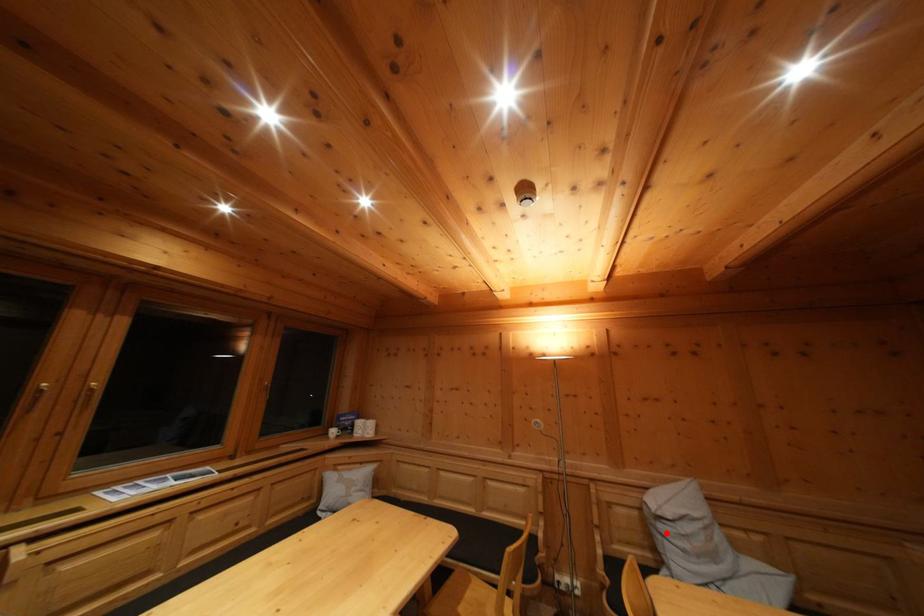
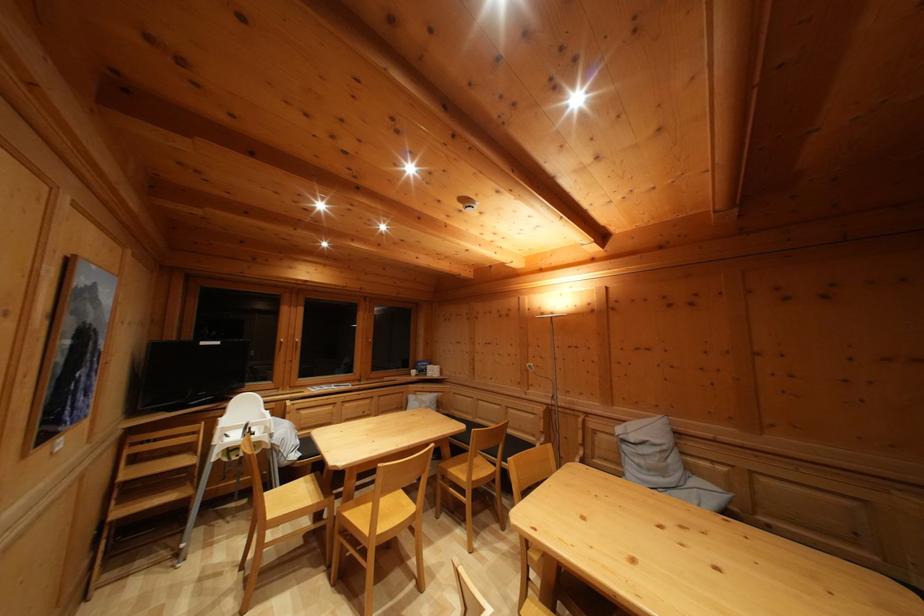
Find the pixel in the second image that matches the highlighted location in the first image.

(629, 454)